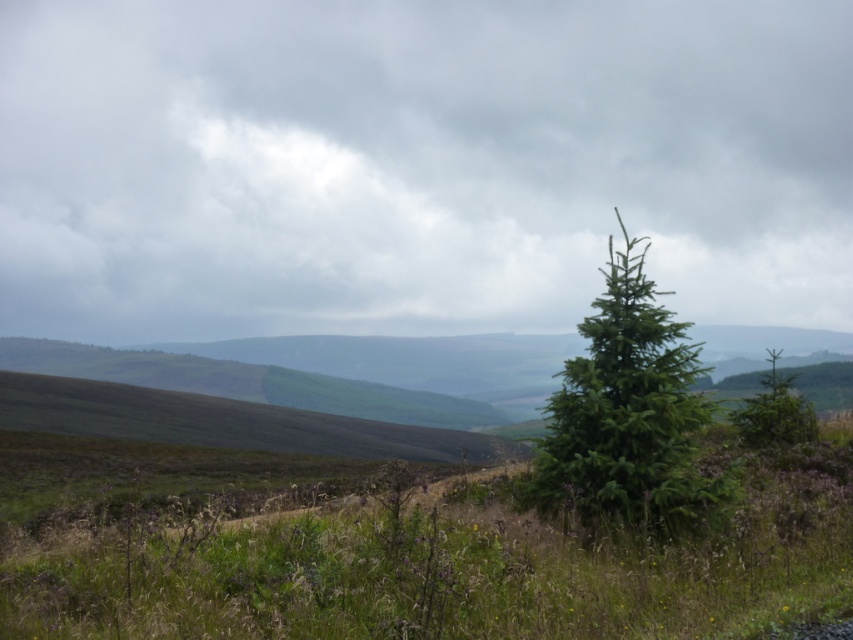
Who is lower down, green needle-like at center or green matte tree at right?

green matte tree at right

Who is shorter, green needle-like at center or green matte tree at right?

With less height is green matte tree at right.

Who is more distant from viewer, (x=582, y=483) or (x=791, y=394)?

Positioned behind is point (x=791, y=394).

Find the location of a particular element. The image size is (853, 640). green needle-like at center is located at coordinates (627, 412).